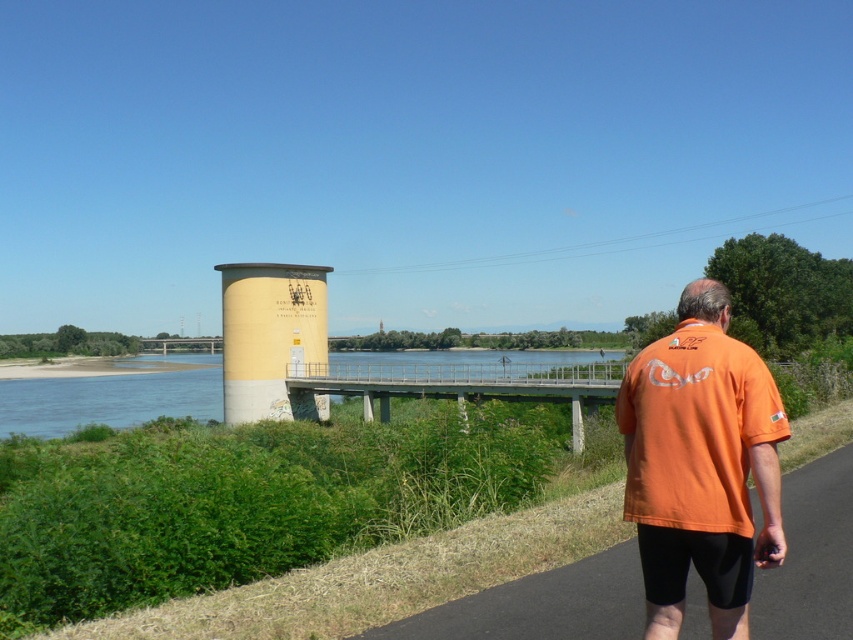
You are standing on the pathway and want to take a photo of the orange fabric shirt at right and the yellow concrete pillar at center. Which object should you focus on first to ensure both are in clear view?

You should focus on the orange fabric shirt at right first since it is closer to the viewer than the yellow concrete pillar at center. By focusing on the closer object, the pillar will also be in focus due to the depth of field.